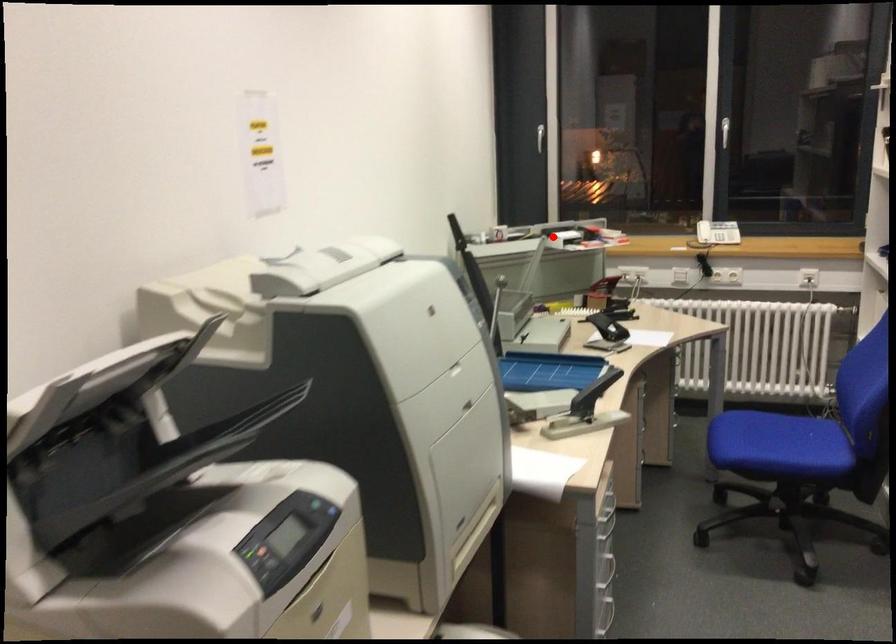
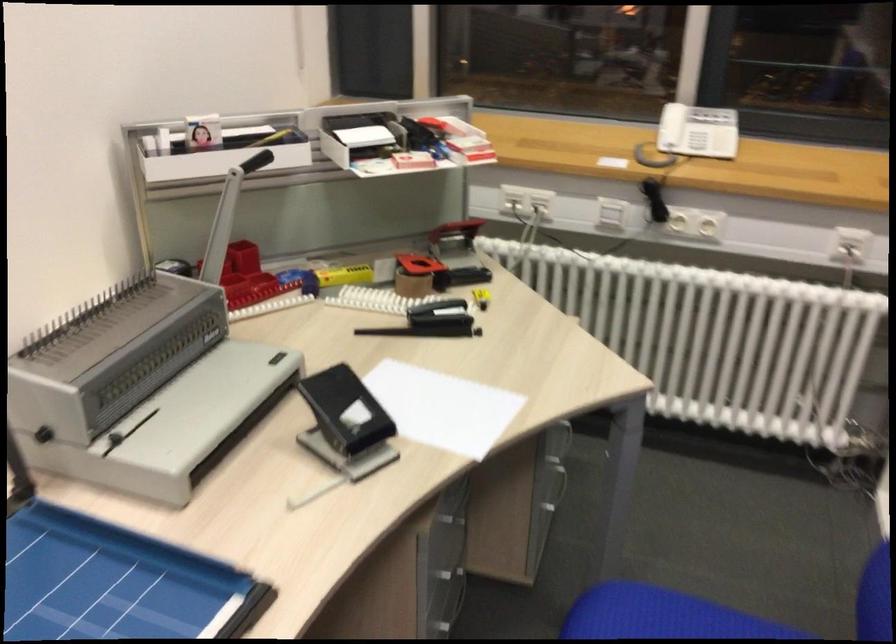
Question: I am providing you with two images of the same scene from different viewpoints. Image1 has a red point marked. In image2, the corresponding 3D location appears at what relative position? Reply with the corresponding letter.

Choices:
 (A) Closer
 (B) Farther

Answer: (A)